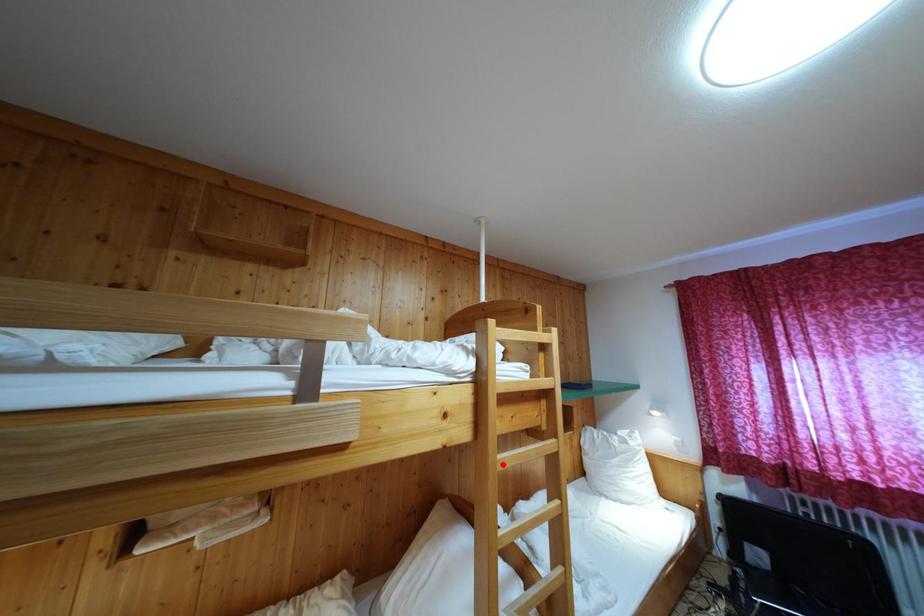
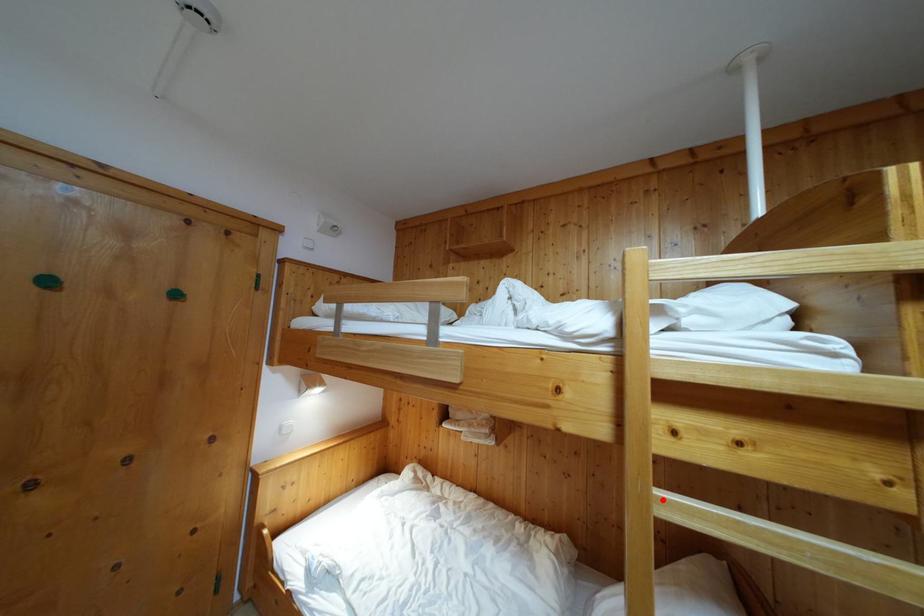
I am providing you with two images of the same scene from different viewpoints. A red point is marked on the first image and another point is marked on the second image. Does the point marked in image1 correspond to the same location as the one in image2?

Yes